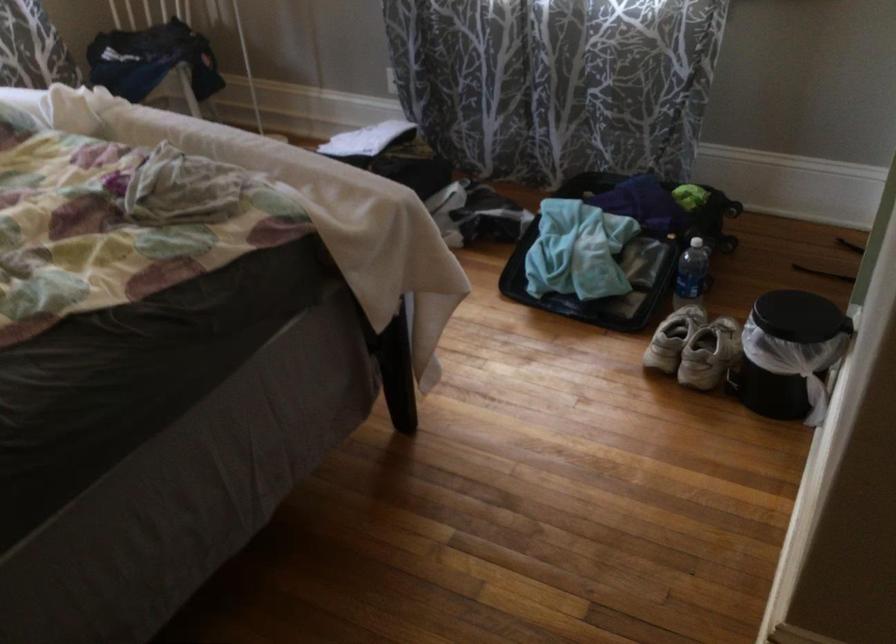
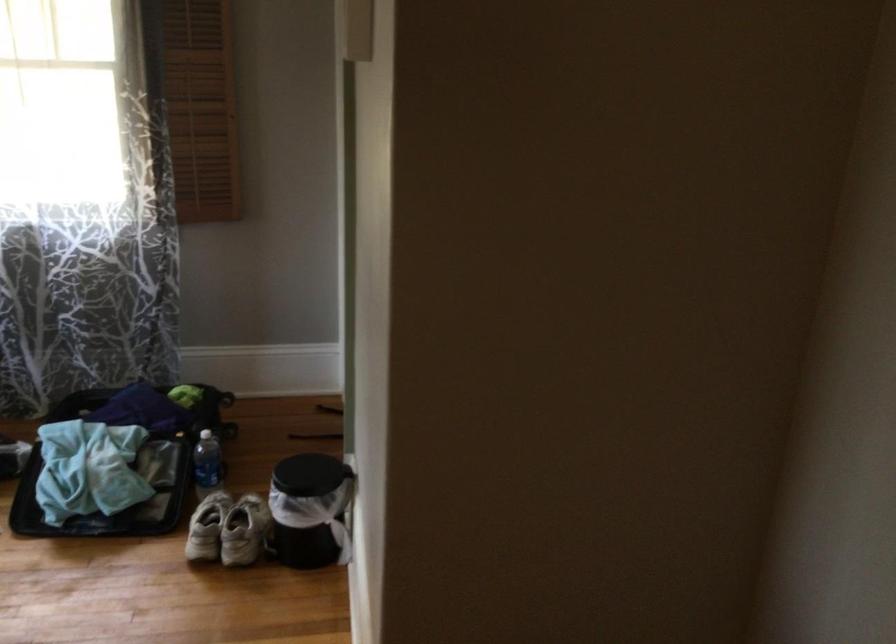
Locate, in the second image, the point that corresponds to (668,337) in the first image.

(207, 527)